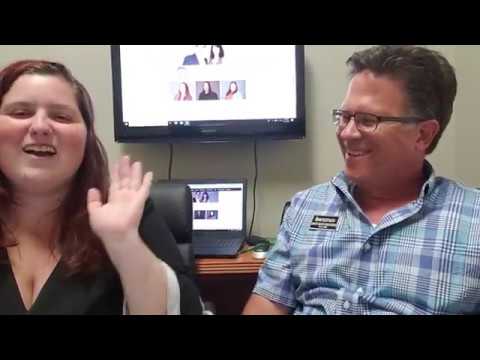
Where is `wire connecting laptop to monitor`? This screenshot has height=360, width=480. wire connecting laptop to monitor is located at coordinates (254, 157).